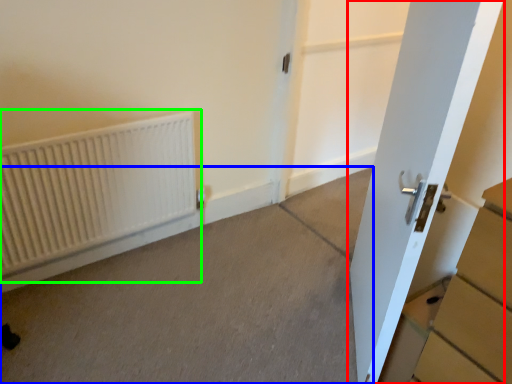
Question: Based on their relative distances, which object is farther from door (highlighted by a red box)? Choose from concrete (highlighted by a blue box) and radiator (highlighted by a green box).

Choices:
 (A) concrete
 (B) radiator

Answer: (B)